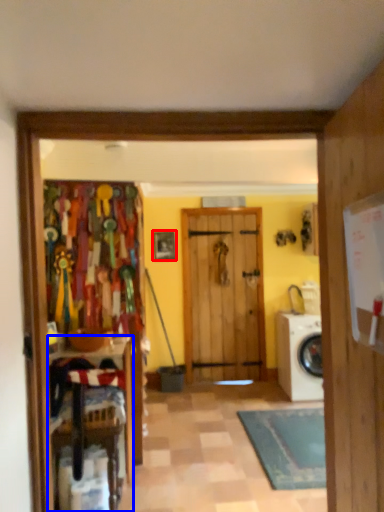
Question: Which of the following is the closest to the observer, picture frame (highlighted by a red box) or furniture (highlighted by a blue box)?

Choices:
 (A) picture frame
 (B) furniture

Answer: (B)